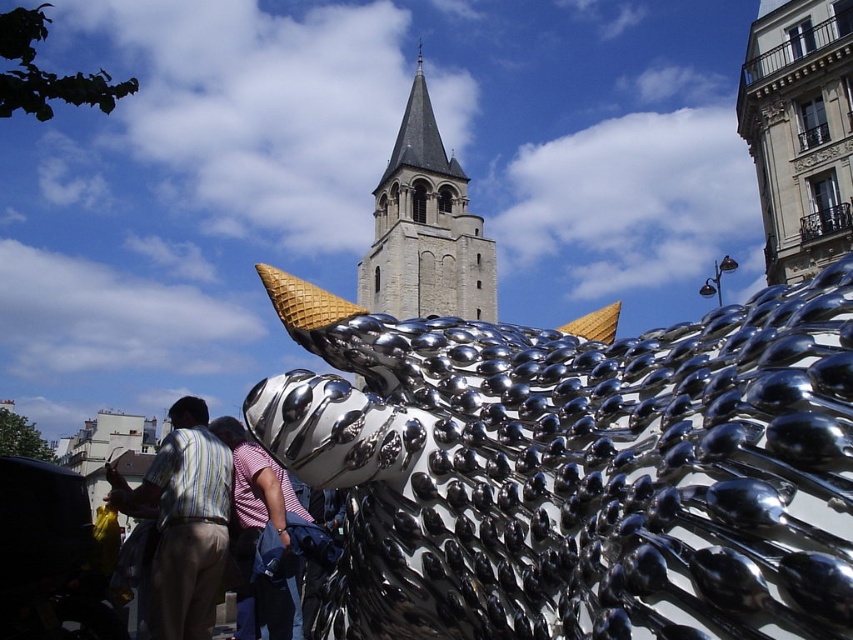
Does shiny metallic fish at center lie in front of striped fabric shirt at lower left?

Yes.

Can you confirm if shiny metallic fish at center is bigger than striped fabric shirt at lower left?

Yes, shiny metallic fish at center is bigger than striped fabric shirt at lower left.

Locate an element on the screen. This screenshot has width=853, height=640. shiny metallic fish at center is located at coordinates (577, 468).

Between gray stone tower at center and striped cotton shirt at center, which one is positioned lower?

Positioned lower is striped cotton shirt at center.

Between point (469, 234) and point (242, 456), which one is positioned in front?

Point (242, 456) is in front.

Which is in front, point (490, 282) or point (231, 481)?

Point (231, 481)

This screenshot has height=640, width=853. I want to click on gray stone tower at center, so click(x=425, y=228).

What do you see at coordinates (577, 468) in the screenshot?
I see `shiny metallic fish at center` at bounding box center [577, 468].

I want to click on shiny metallic fish at center, so click(x=577, y=468).